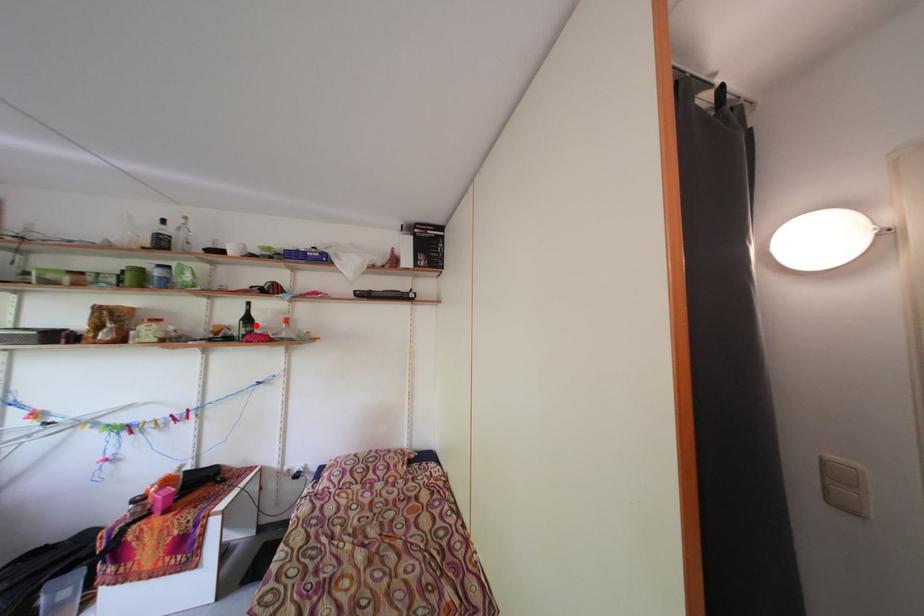
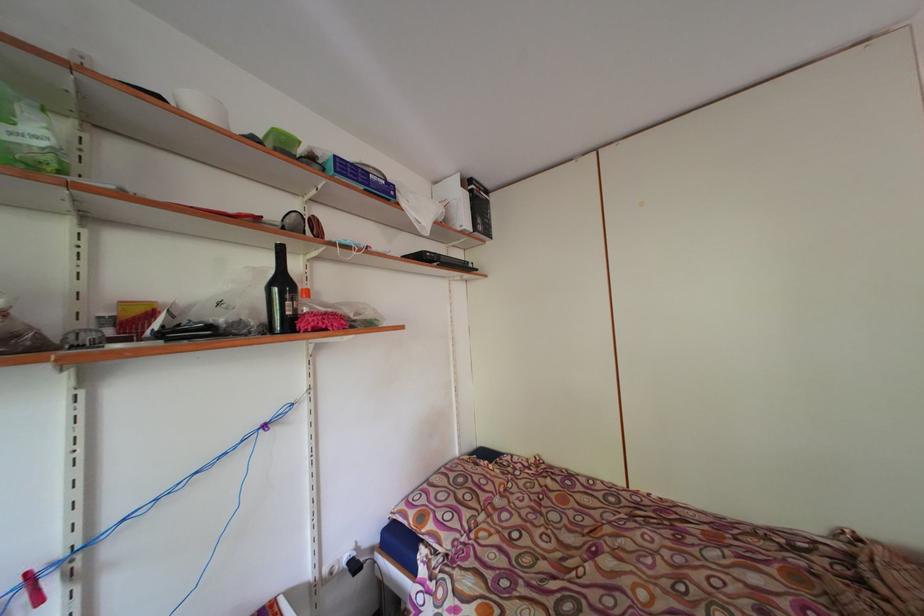
Question: I am providing you with two images of the same scene from different viewpoints. A red point is marked on the first image. Can you still see the location of the red point in image 2?

Choices:
 (A) Yes
 (B) No

Answer: (A)